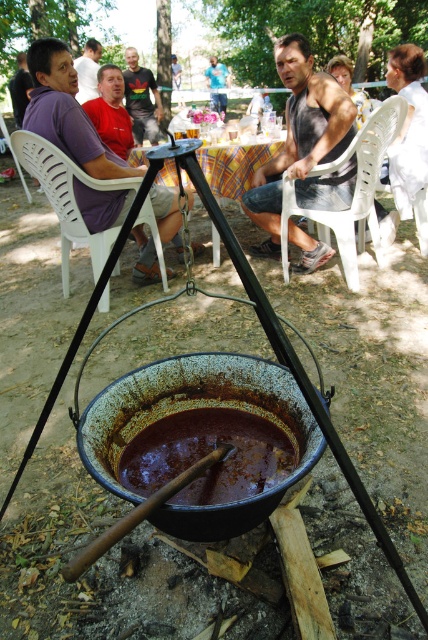
You are at a picnic and want to place a book on the table between the tank top at center and the white plastic chair at center. Which object should you place the book closer to if you want it to be closer to the taller object?

The tank top at center is taller than the white plastic chair at center, so you should place the book closer to the tank top at center to be near the taller object.

You are organizing a clothing donation drive and need to categorize shirts based on their sizes. You have a small donation box and a large donation box. Given that the matte black shirt at upper left and the blue denim shirt at center are in front of you, which shirt should go into the small donation box?

The matte black shirt at upper left should go into the small donation box because its width is less than the blue denim shirt at center, indicating it is smaller in size.